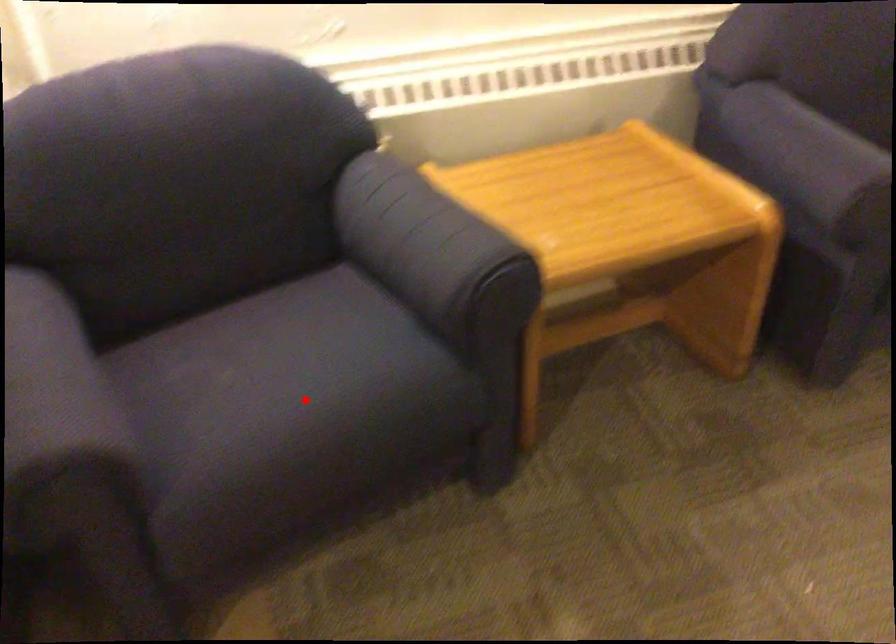
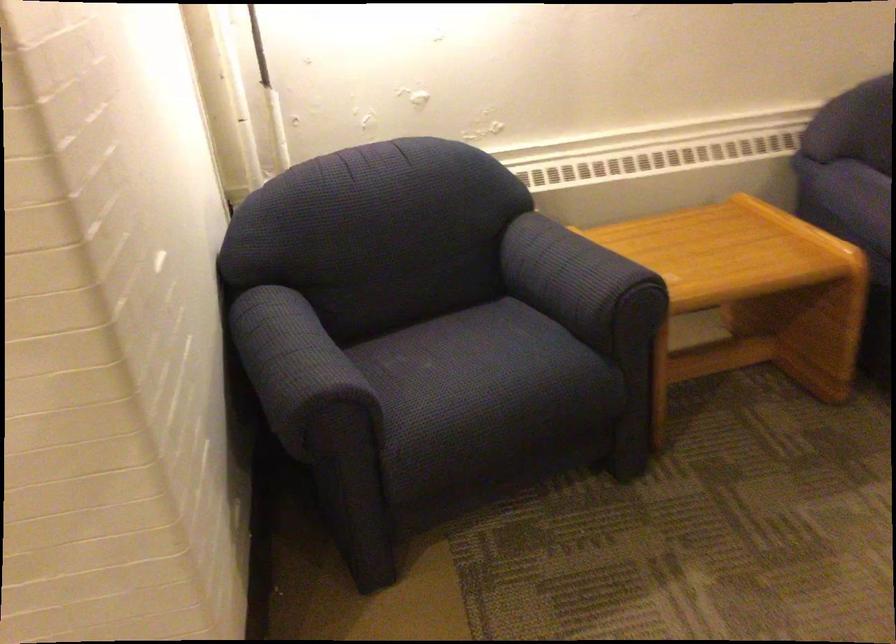
Locate, in the second image, the point that corresponds to the highlighted location in the first image.

(487, 377)